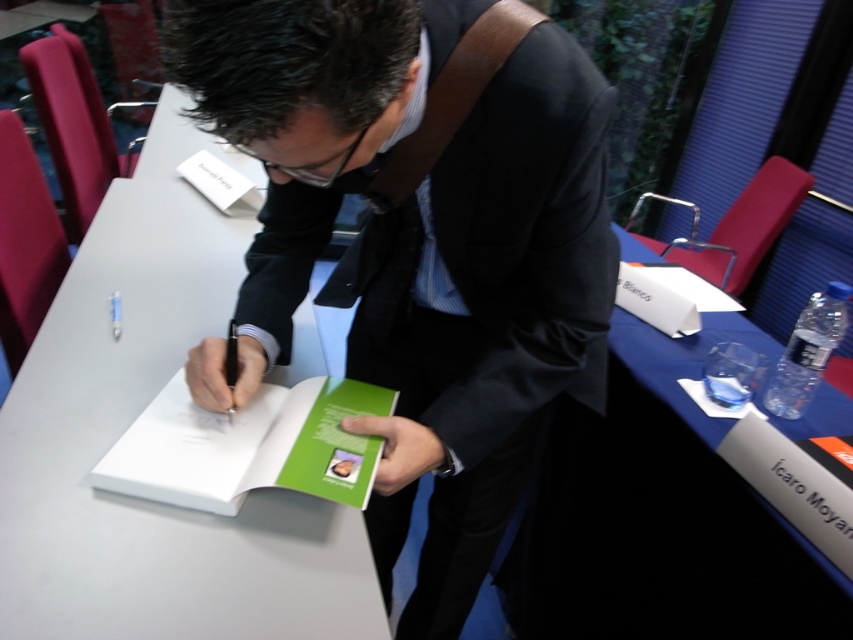
Which is below, matte black suit at center or green matte book at center?

green matte book at center is below.

Is matte black suit at center bigger than green matte book at center?

Yes.

Is point (453, 625) farther from camera compared to point (161, 406)?

Yes, it is behind point (161, 406).

At what (x,y) coordinates should I click in order to perform the action: click on matte black suit at center. Please return your answer as a coordinate pair (x, y). Looking at the image, I should click on (419, 240).

Is green matte book at center in front of black paper at lower right?

Yes.

Which is below, green matte book at center or black paper at lower right?

black paper at lower right is lower down.

Is point (178, 458) closer to camera compared to point (833, 492)?

Yes, it is.

The width and height of the screenshot is (853, 640). I want to click on green matte book at center, so click(x=248, y=445).

Does matte black suit at center appear over black paper at lower right?

Correct, matte black suit at center is located above black paper at lower right.

From the picture: Is matte black suit at center below black paper at lower right?

Actually, matte black suit at center is above black paper at lower right.

Between point (173, 42) and point (769, 476), which one is positioned in front?

Point (173, 42)

The width and height of the screenshot is (853, 640). In order to click on matte black suit at center in this screenshot , I will do tap(419, 240).